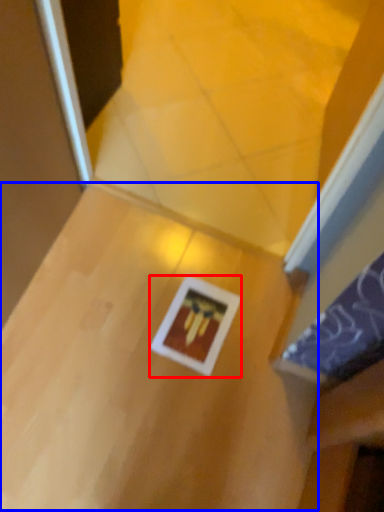
Question: Which object is further to the camera taking this photo, picture frame (highlighted by a red box) or table (highlighted by a blue box)?

Choices:
 (A) picture frame
 (B) table

Answer: (A)